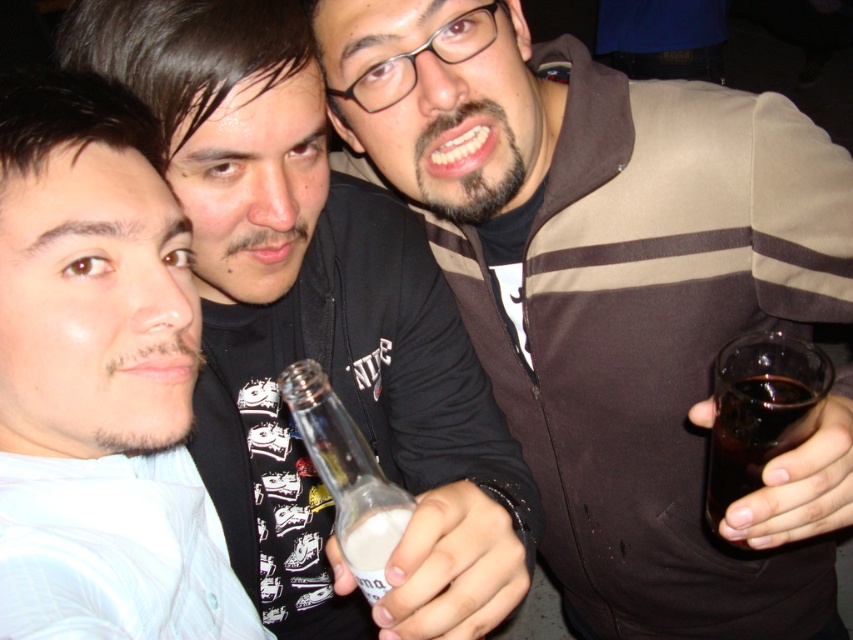
You are a photographer setting up a shot for a magazine cover. You need to ensure that the matte black shirt at center and the dark glass at right are both in focus. Based on their sizes, which object should you prioritize focusing on to ensure clarity?

The matte black shirt at center should be prioritized for focus because it is wider than the dark glass at right, making it a larger subject in the frame.

You are organizing a clothing donation drive and need to categorize items by size. You have a brown fabric jacket at upper right and a matte black shirt at center. Which item should you place in the large size bin?

The brown fabric jacket at upper right is bigger than the matte black shirt at center, so it should be placed in the large size bin.